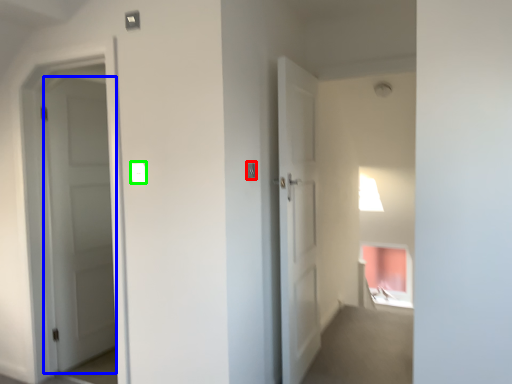
Question: Which object is positioned farthest from light switch (highlighted by a red box)? Select from door (highlighted by a blue box) and light switch (highlighted by a green box).

Choices:
 (A) door
 (B) light switch

Answer: (A)